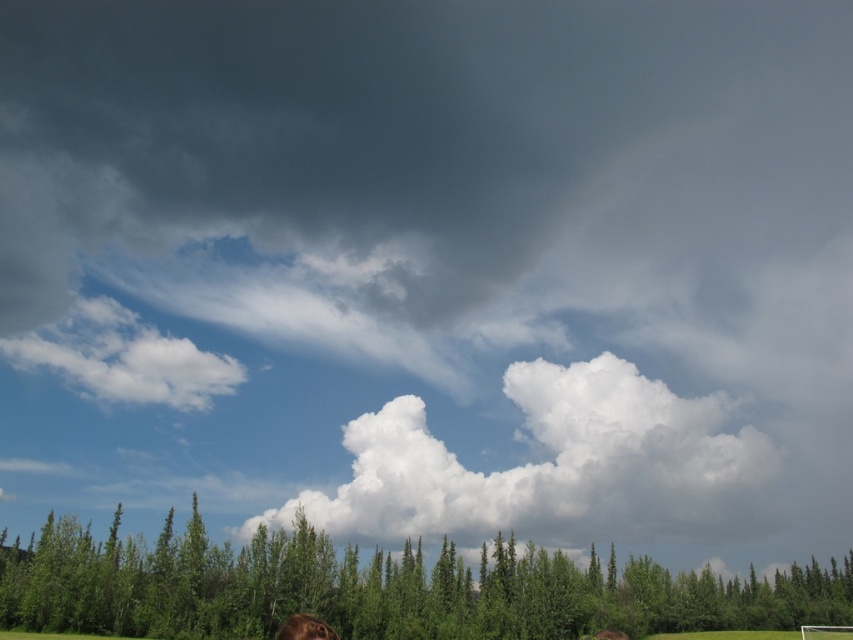
Question: Considering the relative positions of white fluffy cloud at center and white fluffy cloud at upper left in the image provided, where is white fluffy cloud at center located with respect to white fluffy cloud at upper left?

Choices:
 (A) above
 (B) below

Answer: (B)

Question: Can you confirm if white fluffy cloud at center is positioned below white fluffy cloud at upper left?

Choices:
 (A) no
 (B) yes

Answer: (B)

Question: Which point is closer to the camera?

Choices:
 (A) (10, 340)
 (B) (605, 502)

Answer: (B)

Question: Does white fluffy cloud at center appear under white fluffy cloud at upper left?

Choices:
 (A) no
 (B) yes

Answer: (B)